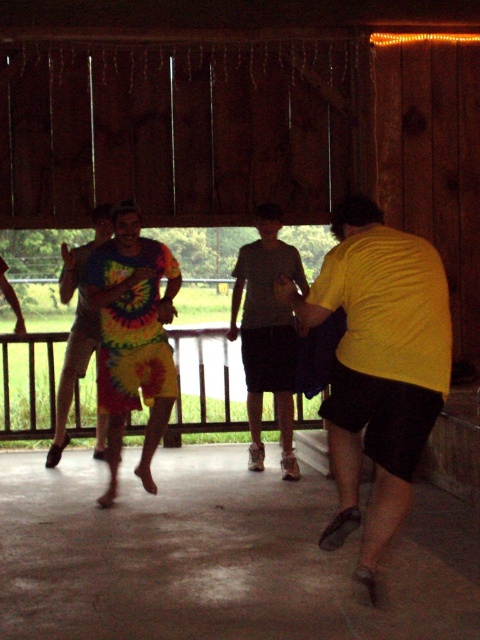
Is yellow matte shirt at right above tie-dye shorts at center?

Actually, yellow matte shirt at right is below tie-dye shorts at center.

Is point (364, 380) closer to viewer compared to point (123, 227)?

Yes, it is in front of point (123, 227).

Is point (394, 298) less distant than point (117, 458)?

Yes, point (394, 298) is closer to viewer.

You are a GUI agent. You are given a task and a screenshot of the screen. Output one action in this format:
    pyautogui.click(x=<x>, y=<y>)
    Task: Click on the yellow matte shirt at right
    
    Given the screenshot: What is the action you would take?
    pyautogui.click(x=377, y=368)

In the scene shown: Between tie-dye shorts at center and tie-dye shorts at left, which one is positioned higher?

tie-dye shorts at left is higher up.

Is point (162, 301) in front of point (110, 227)?

Yes.

Measure the distance between point (x=111, y=328) and camera.

Point (x=111, y=328) and camera are 23.22 feet apart.

Identify the location of tie-dye shorts at center. (132, 337).

Is gray cotton shirt at center behind tie-dye shorts at left?

No, gray cotton shirt at center is closer to the viewer.

Is gray cotton shirt at center positioned before tie-dye shorts at left?

That is True.

Which is in front, point (238, 264) or point (60, 397)?

Point (238, 264)

Find the location of a particular element. gray cotton shirt at center is located at coordinates (267, 332).